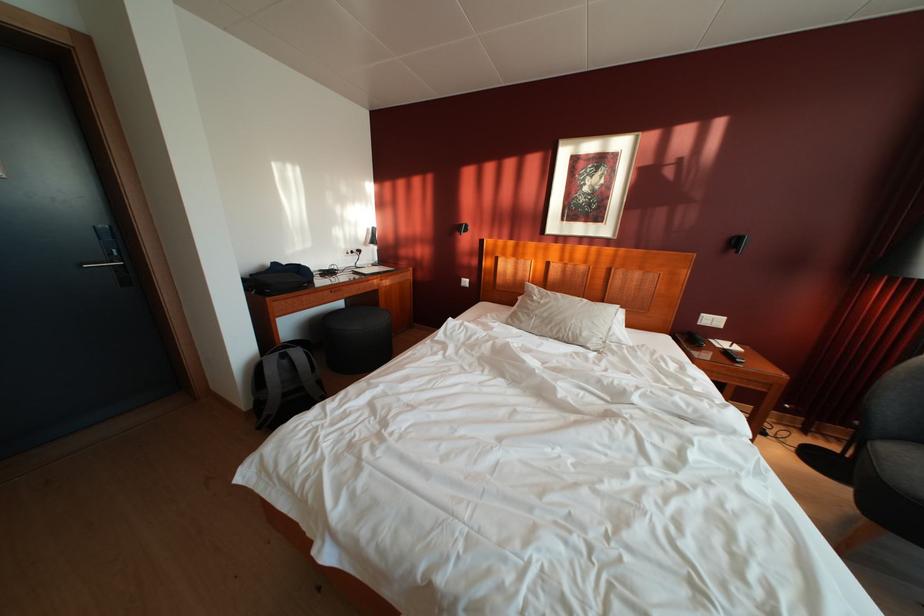
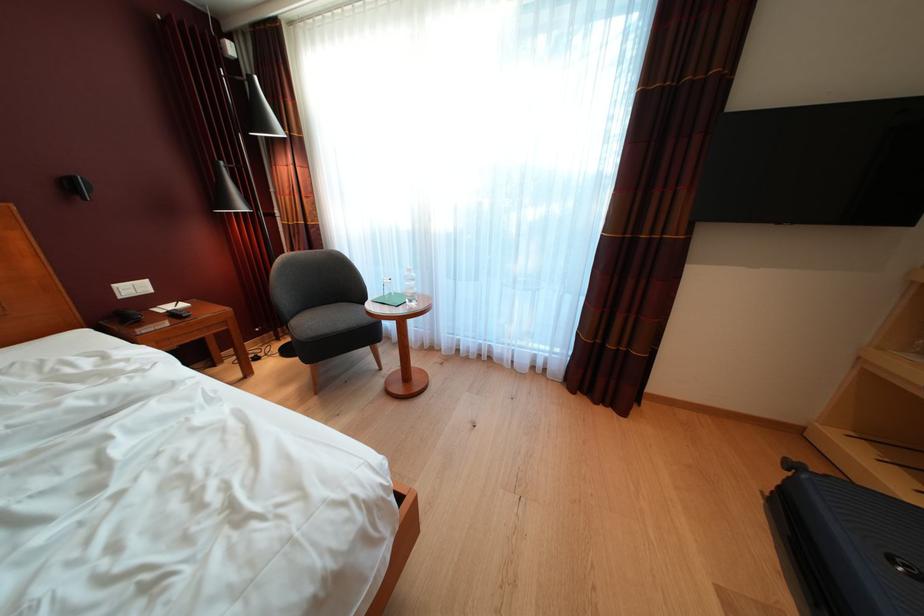
In the second image, find the point that corresponds to point (732, 350) in the first image.

(176, 314)